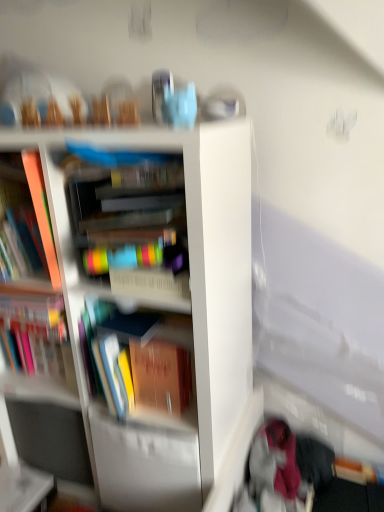
Question: Considering the relative sizes of multicolored plastic container at center, which is the first book in right-to-left order, and white glossy table at lower left in the image provided, is multicolored plastic container at center, which is the first book in right-to-left order, taller than white glossy table at lower left?

Choices:
 (A) no
 (B) yes

Answer: (B)

Question: Is multicolored plastic container at center, acting as the 4th book starting from the left, smaller than white glossy table at lower left?

Choices:
 (A) yes
 (B) no

Answer: (B)

Question: Is multicolored plastic container at center, which is the first book in right-to-left order, bigger than white glossy table at lower left?

Choices:
 (A) yes
 (B) no

Answer: (A)

Question: Does multicolored plastic container at center, acting as the 4th book starting from the left, touch white glossy table at lower left?

Choices:
 (A) yes
 (B) no

Answer: (B)

Question: From a real-world perspective, is multicolored plastic container at center, which is the first book in right-to-left order, on top of white glossy table at lower left?

Choices:
 (A) yes
 (B) no

Answer: (A)

Question: Is multicolored plastic container at center, which is the first book in right-to-left order, far away from white glossy table at lower left?

Choices:
 (A) no
 (B) yes

Answer: (A)

Question: Is velvet pink scarf at lower right not inside white glossy bookcase at center?

Choices:
 (A) no
 (B) yes

Answer: (B)

Question: From a real-world perspective, is velvet pink scarf at lower right on top of white glossy bookcase at center?

Choices:
 (A) no
 (B) yes

Answer: (A)

Question: Could you tell me if velvet pink scarf at lower right is facing white glossy bookcase at center?

Choices:
 (A) yes
 (B) no

Answer: (B)

Question: Considering the relative sizes of velvet pink scarf at lower right and white glossy bookcase at center in the image provided, is velvet pink scarf at lower right bigger than white glossy bookcase at center?

Choices:
 (A) yes
 (B) no

Answer: (B)

Question: Does velvet pink scarf at lower right have a greater height compared to white glossy bookcase at center?

Choices:
 (A) yes
 (B) no

Answer: (B)

Question: Does velvet pink scarf at lower right have a lesser width compared to white glossy bookcase at center?

Choices:
 (A) no
 (B) yes

Answer: (B)

Question: From a real-world perspective, is matte orange book at left, which is the second book from left to right, physically above hardcover book at center, positioned as the second book in right-to-left order?

Choices:
 (A) yes
 (B) no

Answer: (B)